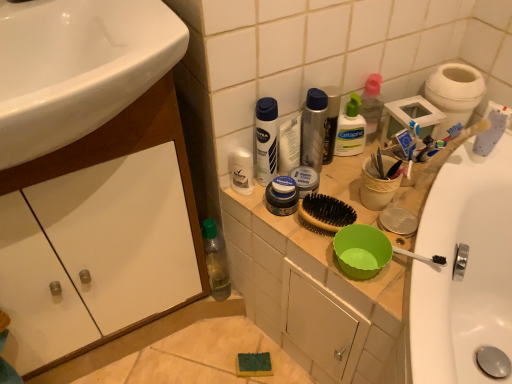
Question: Is white glossy cabinet at lower left shorter than metallic silver deodorant at upper center, acting as the 2th toiletry starting from the right?

Choices:
 (A) yes
 (B) no

Answer: (B)

Question: Can you confirm if white glossy cabinet at lower left is taller than metallic silver deodorant at upper center, acting as the 2th toiletry starting from the right?

Choices:
 (A) no
 (B) yes

Answer: (B)

Question: Is white glossy cabinet at lower left facing away from metallic silver deodorant at upper center, the 3th toiletry viewed from the left?

Choices:
 (A) no
 (B) yes

Answer: (A)

Question: Is metallic silver deodorant at upper center, the 3th toiletry viewed from the left, surrounded by white glossy cabinet at lower left?

Choices:
 (A) no
 (B) yes

Answer: (A)

Question: Is there a large distance between white glossy cabinet at lower left and metallic silver deodorant at upper center, the 3th toiletry viewed from the left?

Choices:
 (A) yes
 (B) no

Answer: (B)

Question: From a real-world perspective, relative to metallic silver deodorant at upper center, the 3th toiletry viewed from the left, is white matte nivea spray can at center, the second mouthwash in the right-to-left sequence, vertically above or below?

Choices:
 (A) above
 (B) below

Answer: (B)

Question: Is white matte nivea spray can at center, the 1th mouthwash viewed from the left, situated inside metallic silver deodorant at upper center, the 3th toiletry viewed from the left, or outside?

Choices:
 (A) outside
 (B) inside

Answer: (A)

Question: Is white matte nivea spray can at center, the 1th mouthwash viewed from the left, taller or shorter than metallic silver deodorant at upper center, the 3th toiletry viewed from the left?

Choices:
 (A) short
 (B) tall

Answer: (A)

Question: Would you say white matte nivea spray can at center, the second mouthwash in the right-to-left sequence, is to the left or to the right of metallic silver deodorant at upper center, acting as the 2th toiletry starting from the right, in the picture?

Choices:
 (A) right
 (B) left

Answer: (B)

Question: Looking at their shapes, would you say green plastic bottle at lower left is wider or thinner than translucent plastic mouthwash at center, which is the 2th mouthwash from left to right?

Choices:
 (A) thin
 (B) wide

Answer: (B)

Question: Is point 211,248 positioned closer to the camera than point 329,92?

Choices:
 (A) closer
 (B) farther

Answer: (B)

Question: Considering the relative positions of green plastic bottle at lower left and translucent plastic mouthwash at center, which is the 2th mouthwash from left to right, in the image provided, is green plastic bottle at lower left to the left or to the right of translucent plastic mouthwash at center, which is the 2th mouthwash from left to right,?

Choices:
 (A) left
 (B) right

Answer: (A)

Question: Is green plastic bottle at lower left bigger or smaller than translucent plastic mouthwash at center, the first mouthwash positioned from the right?

Choices:
 (A) big
 (B) small

Answer: (A)

Question: In terms of size, does clear plastic bottle at upper center, which is the first toiletry from right to left, appear bigger or smaller than green plastic bottle at lower left?

Choices:
 (A) big
 (B) small

Answer: (B)

Question: Relative to green plastic bottle at lower left, is clear plastic bottle at upper center, the fourth toiletry viewed from the left, in front or behind?

Choices:
 (A) behind
 (B) front

Answer: (B)